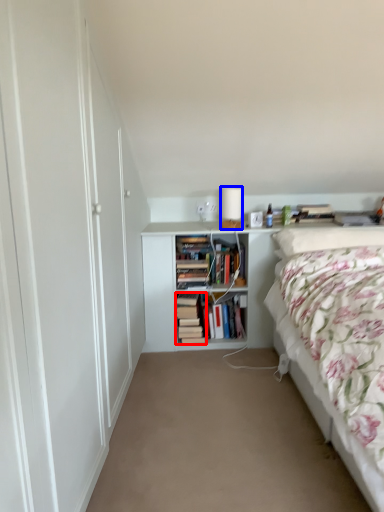
Question: Which object is further to the camera taking this photo, book (highlighted by a red box) or table lamp (highlighted by a blue box)?

Choices:
 (A) book
 (B) table lamp

Answer: (A)